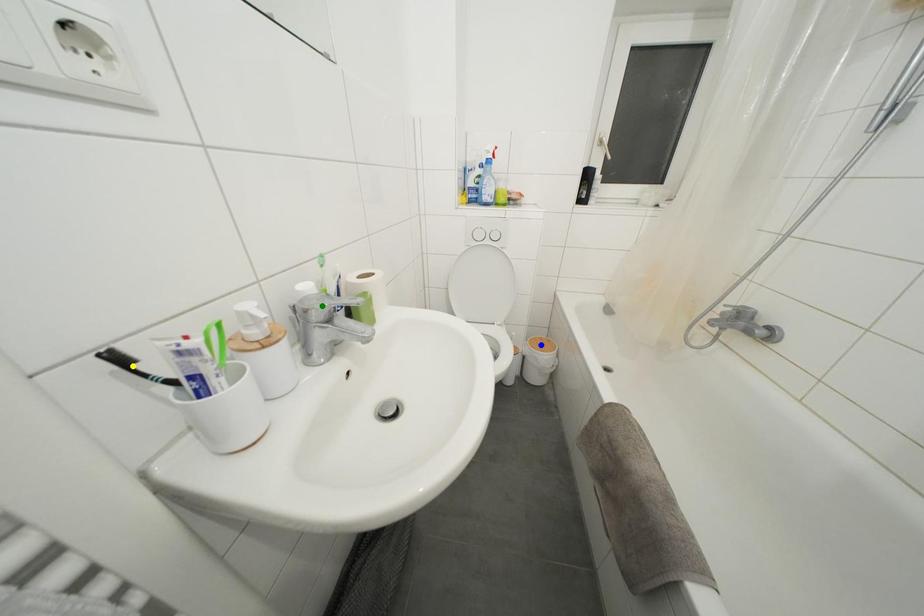
Order these from nearest to farthest:
yellow point
blue point
green point

1. yellow point
2. green point
3. blue point